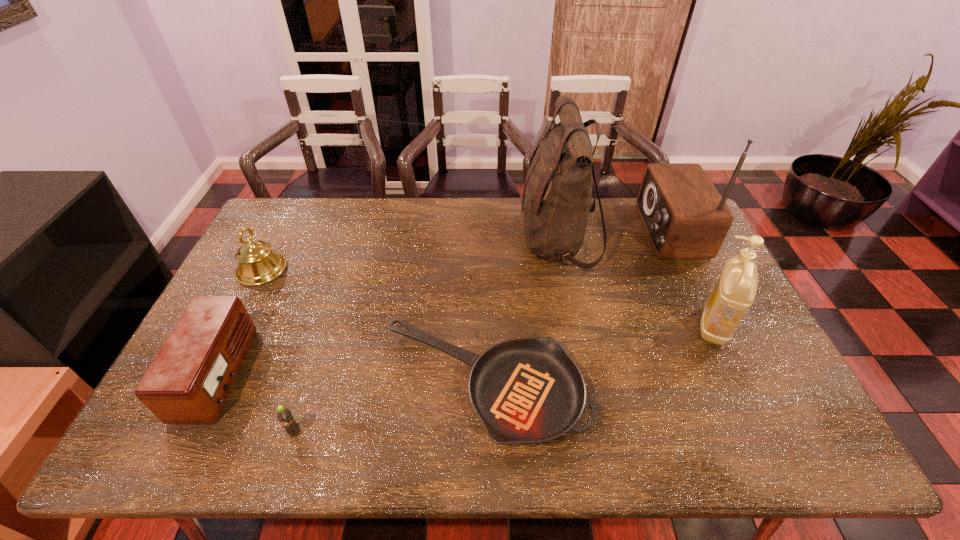
This screenshot has width=960, height=540. I want to click on backpack, so click(557, 194).

Where is `the right radio receiver`? the right radio receiver is located at coordinates [685, 217].

Locate an element on the screen. the taller radio receiver is located at coordinates (685, 217).

Identify the location of the fifth shortest object. (734, 293).

This screenshot has width=960, height=540. I want to click on bell, so click(x=257, y=264).

At what (x,y) coordinates should I click in order to perform the action: click on the third shortest object. Please return your answer as a coordinate pair (x, y). Looking at the image, I should click on (188, 381).

I want to click on the shorter radio receiver, so click(188, 381).

What are the coordinates of `the third object from left to right` in the screenshot? It's located at (284, 415).

Where is `the second shortest object`? Image resolution: width=960 pixels, height=540 pixels. the second shortest object is located at coordinates (284, 415).

At what (x,y) coordinates should I click in order to perform the action: click on frying pan. Please return your answer as a coordinate pair (x, y). Image resolution: width=960 pixels, height=540 pixels. Looking at the image, I should click on (525, 390).